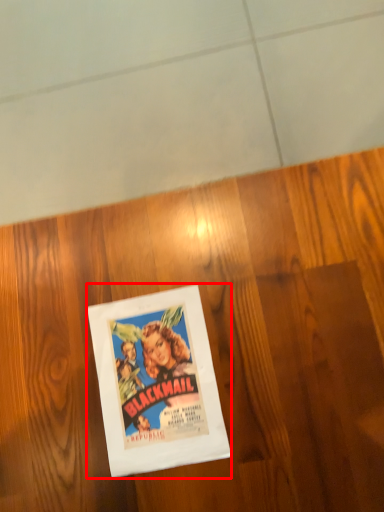
Question: From the image's perspective, what is the correct spatial positioning of picture frame (annotated by the red box) in reference to plywood?

Choices:
 (A) below
 (B) above

Answer: (A)